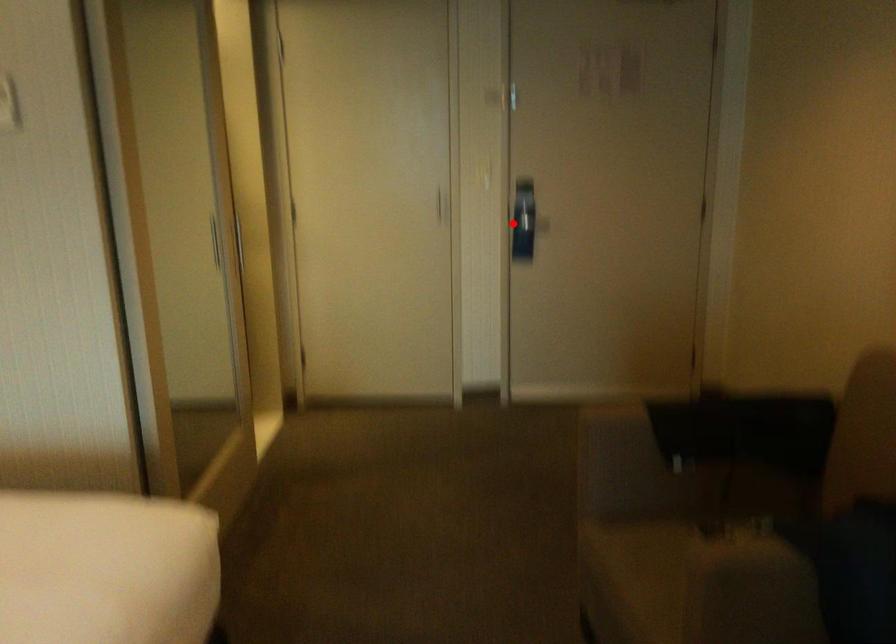
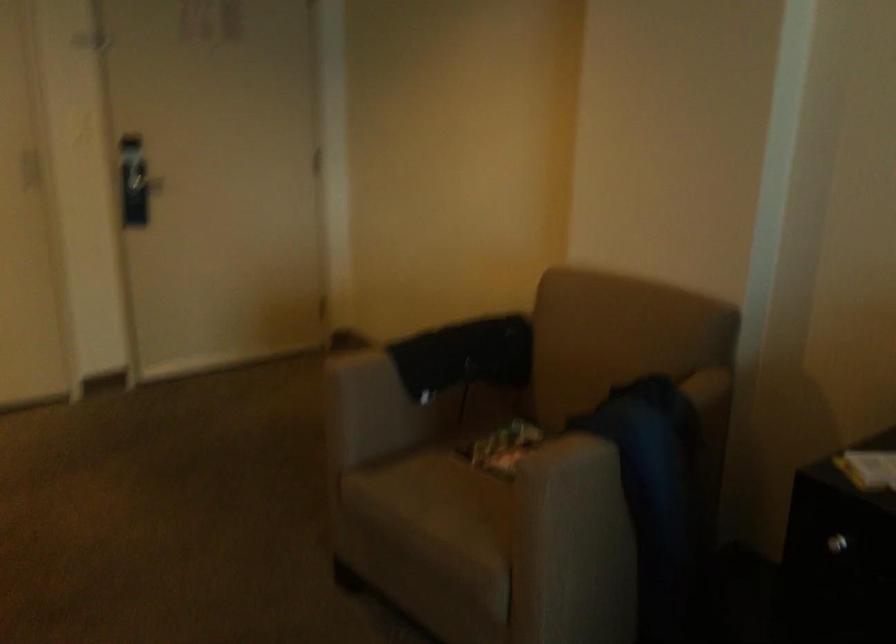
In the second image, find the point that corresponds to the highlighted location in the first image.

(135, 182)